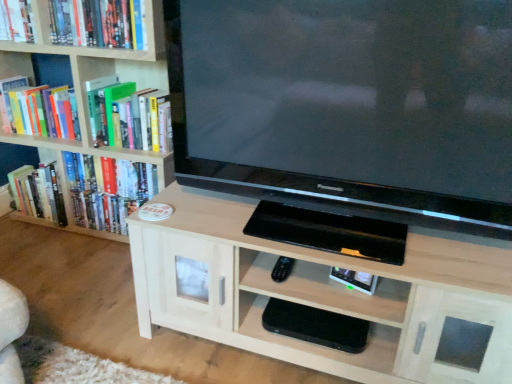
Question: In which direction should I rotate to look at black plastic shelf at lower center, which is the 2th shelf in top-to-bottom order?

Choices:
 (A) right
 (B) left

Answer: (A)

Question: Can you confirm if hardcover book at left, placed as the fifth book when sorted from top to bottom, is positioned to the left of light wood cabinet at center, positioned as the 2th shelf in bottom-to-top order?

Choices:
 (A) yes
 (B) no

Answer: (A)

Question: Is hardcover book at left, placed as the fifth book when sorted from top to bottom, bigger than light wood cabinet at center, positioned as the 2th shelf in bottom-to-top order?

Choices:
 (A) no
 (B) yes

Answer: (A)

Question: Considering the relative sizes of hardcover book at left, placed as the fifth book when sorted from top to bottom, and light wood cabinet at center, positioned as the 2th shelf in bottom-to-top order, in the image provided, is hardcover book at left, placed as the fifth book when sorted from top to bottom, taller than light wood cabinet at center, positioned as the 2th shelf in bottom-to-top order,?

Choices:
 (A) no
 (B) yes

Answer: (A)

Question: From the image's perspective, does hardcover book at left, which appears as the 1th book when ordered from the bottom, appear higher than light wood cabinet at center, arranged as the first shelf when viewed from the top?

Choices:
 (A) no
 (B) yes

Answer: (B)

Question: Is hardcover book at left, which appears as the 1th book when ordered from the bottom, further to the viewer compared to light wood cabinet at center, positioned as the 2th shelf in bottom-to-top order?

Choices:
 (A) no
 (B) yes

Answer: (B)

Question: Is hardcover book at left, placed as the fifth book when sorted from top to bottom, at the right side of light wood cabinet at center, positioned as the 2th shelf in bottom-to-top order?

Choices:
 (A) no
 (B) yes

Answer: (A)

Question: Does black plastic shelf at lower center, which is the 2th shelf in top-to-bottom order, have a smaller size compared to black glossy television at center?

Choices:
 (A) yes
 (B) no

Answer: (A)

Question: Is black plastic shelf at lower center, which is the 2th shelf in top-to-bottom order, outside black glossy television at center?

Choices:
 (A) yes
 (B) no

Answer: (A)

Question: Can you confirm if black plastic shelf at lower center, which is the 2th shelf in top-to-bottom order, is shorter than black glossy television at center?

Choices:
 (A) no
 (B) yes

Answer: (B)

Question: Does black plastic shelf at lower center, which is the 2th shelf in top-to-bottom order, lie behind black glossy television at center?

Choices:
 (A) no
 (B) yes

Answer: (B)

Question: Does black plastic shelf at lower center, which is the 2th shelf in top-to-bottom order, turn towards black glossy television at center?

Choices:
 (A) no
 (B) yes

Answer: (A)

Question: Considering the relative positions of black plastic shelf at lower center, which is the 2th shelf in top-to-bottom order, and black glossy television at center in the image provided, is black plastic shelf at lower center, which is the 2th shelf in top-to-bottom order, to the left of black glossy television at center from the viewer's perspective?

Choices:
 (A) yes
 (B) no

Answer: (A)

Question: Are hardcover book at upper left, which ranks as the third book in bottom-to-top order, and hardcover book at upper left, acting as the 1th book starting from the top, located far from each other?

Choices:
 (A) yes
 (B) no

Answer: (B)